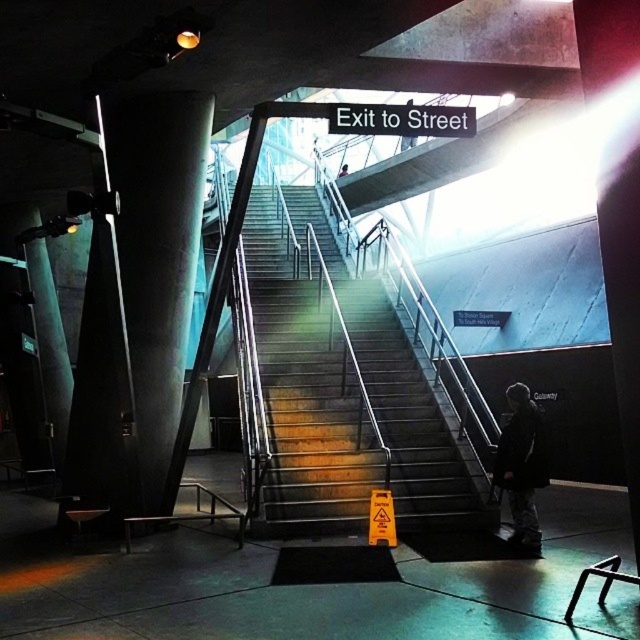
You are standing at the bottom of the staircase and want to reach the exit. There are two points marked on the floor in front of you. One is at point (124, 230) and the other is at point (339, 173). Which point is closer to the exit?

Point (124, 230) is in front of point (339, 173), so it is closer to the exit.

You are standing at the bottom of the staircase and want to reach the exit. There is a sleek concrete pillar at left and a pink fabric person at center in your way. Which object is larger and might block your path more?

The sleek concrete pillar at left is bigger than the pink fabric person at center, so it might block your path more.

You are a person standing at the bottom of the staircase and want to hang your dark gray jacket at lower right on a hook near the sleek concrete pillar at left. Can you reach the hook if the jacket is hanging from the pillar?

The sleek concrete pillar at left is taller than the dark gray jacket at lower right, so the hook near the pillar is likely out of reach unless you use a step stool.